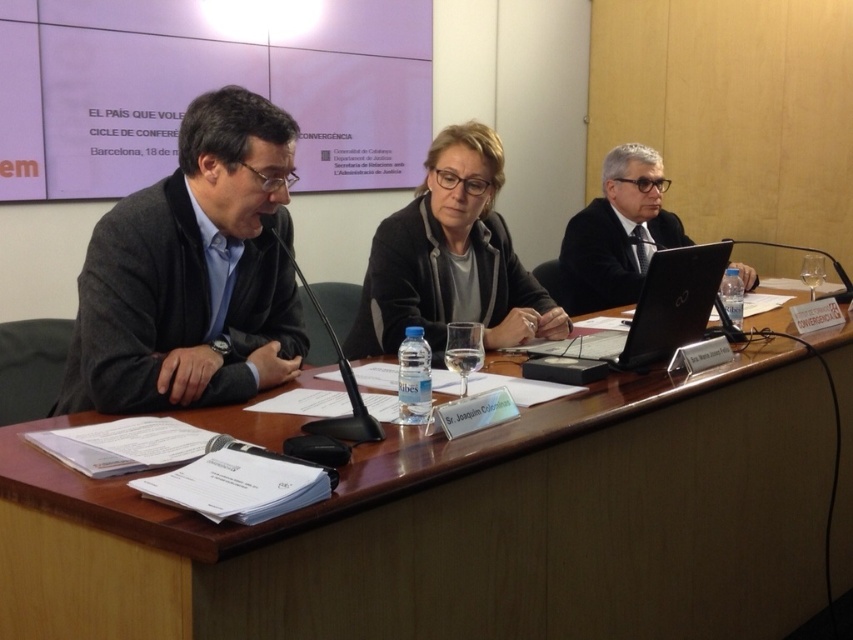
You are organizing a conference and need to ensure that the matte black suit at left and the black plastic laptop at center can fit side by side on a shelf that is 1.2 meters wide. Based on their widths, can both items be placed together on the shelf without overlapping?

The matte black suit at left might be wider than the black plastic laptop at center. However, without knowing the exact width of the matte black suit at left, it is uncertain if both items can fit on the 1.2 meter shelf. Additional measurements are needed to confirm.

You are organizing a meeting and need to place a 12cm wide notebook between the wooden at left and the black plastic laptop at center. Can you fit it there?

The wooden at left is positioned on the left side of black plastic laptop at center, so there is space between them. The notebook is 12cm wide, but the exact distance between the objects isn not provided. Without knowing the available space, it is uncertain if the notebook will fit.